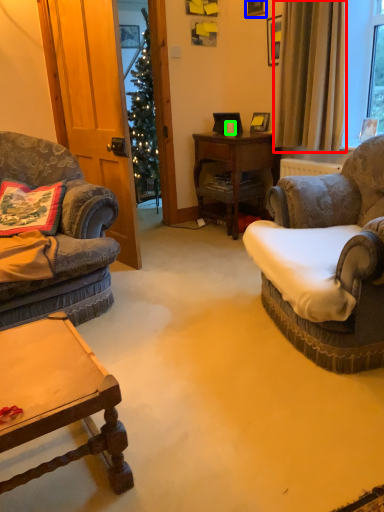
Question: Which object is positioned closest to curtain (highlighted by a red box)? Select from picture frame (highlighted by a blue box) and coffee cup (highlighted by a green box).

Choices:
 (A) picture frame
 (B) coffee cup

Answer: (B)